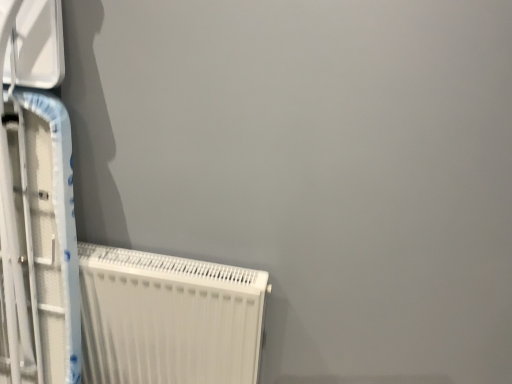
Measure the distance between white plastic heater at lower left and camera.

white plastic heater at lower left is 3.75 feet away from camera.

This screenshot has width=512, height=384. Identify the location of white plastic heater at lower left. (168, 318).

What do you see at coordinates (168, 318) in the screenshot? Image resolution: width=512 pixels, height=384 pixels. I see `white plastic heater at lower left` at bounding box center [168, 318].

You are a GUI agent. You are given a task and a screenshot of the screen. Output one action in this format:
    pyautogui.click(x=<x>, y=<y>)
    Task: Click on the white plastic heater at lower left
    This screenshot has height=384, width=512.
    Given the screenshot: What is the action you would take?
    pyautogui.click(x=168, y=318)